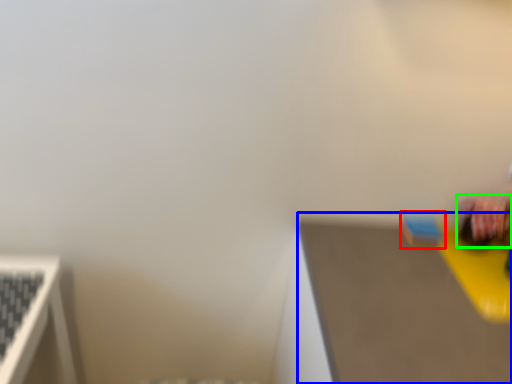
Question: Which object is positioned closest to toy (highlighted by a red box)? Select from table top (highlighted by a blue box) and toy (highlighted by a green box).

Choices:
 (A) table top
 (B) toy

Answer: (B)